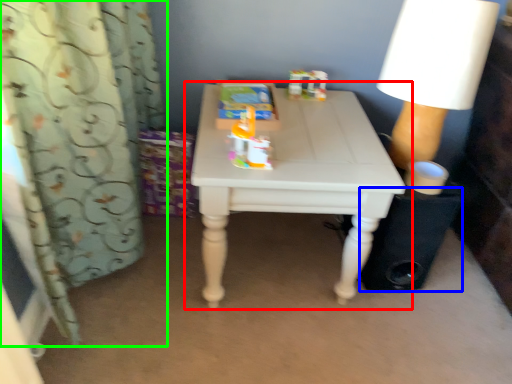
Question: Based on their relative distances, which object is nearer to table (highlighted by a red box)? Choose from speaker (highlighted by a blue box) and curtain (highlighted by a green box).

Choices:
 (A) speaker
 (B) curtain

Answer: (A)